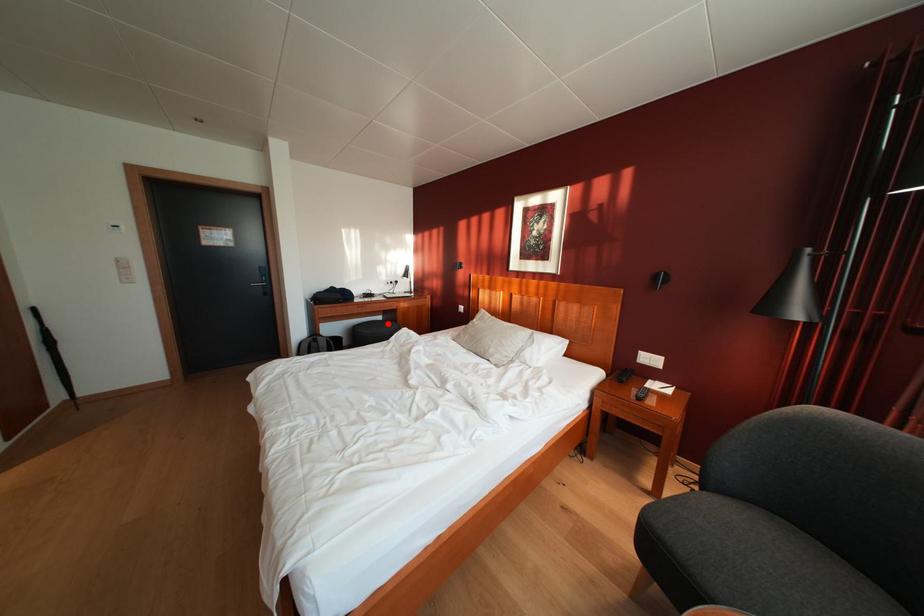
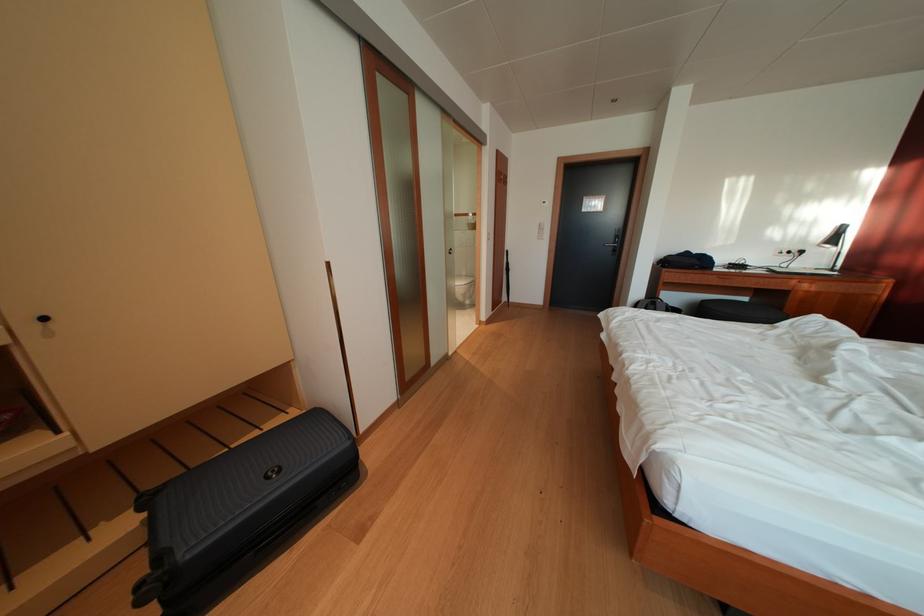
Question: I am providing you with two images of the same scene from different viewpoints. A red point is shown in image1. For the corresponding object point in image2, is it positioned nearer or farther from the camera?

Choices:
 (A) Nearer
 (B) Farther

Answer: (A)